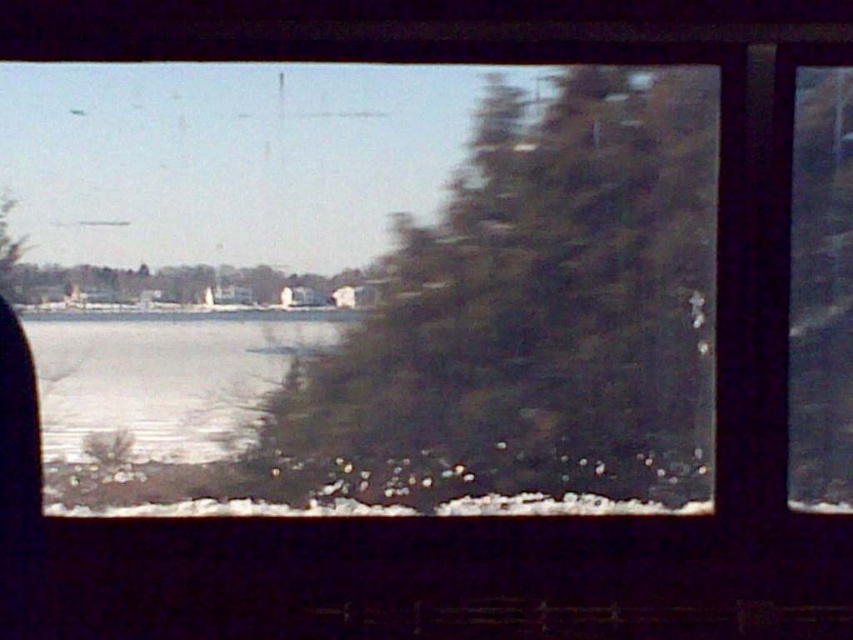
You are standing outside looking through the window. You see the green textured tree at center and the clear ice at lower left. Which object is nearer to you?

The green textured tree at center is closer to the viewer than the clear ice at lower left.

Consider the image. You are standing in a winter landscape with a frozen body of water and a cluster of evergreen trees. You see a point marked at coordinates (529, 316). What object does this point correspond to?

The point at coordinates (529, 316) corresponds to the green textured tree at center.